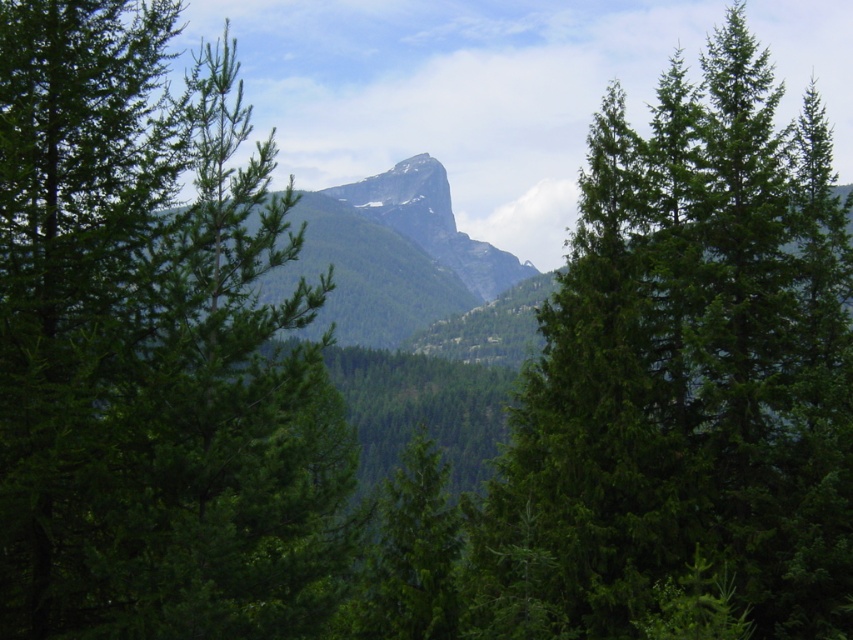
Is green matte tree at center shorter than green textured mountain at center?

Indeed, green matte tree at center has a lesser height compared to green textured mountain at center.

Is the position of green matte tree at center more distant than that of green textured mountain at center?

No, green matte tree at center is closer to the viewer.

Is point (531, 605) positioned before point (397, 339)?

Yes, point (531, 605) is in front of point (397, 339).

Find the location of a particular element. green matte tree at center is located at coordinates (685, 376).

Who is more distant from viewer, (267, 234) or (718, 451)?

The point (718, 451) is behind.

Consider the image. Between green needle-like tree at center and green matte tree at center, which one appears on the right side from the viewer's perspective?

Positioned to the right is green matte tree at center.

The width and height of the screenshot is (853, 640). I want to click on green needle-like tree at center, so click(151, 349).

Does point (256, 330) come closer to viewer compared to point (436, 246)?

That is True.

Is green needle-like tree at center further to the viewer compared to green textured mountain at center?

No, green needle-like tree at center is in front of green textured mountain at center.

What do you see at coordinates (151, 349) in the screenshot? This screenshot has width=853, height=640. I see `green needle-like tree at center` at bounding box center [151, 349].

Image resolution: width=853 pixels, height=640 pixels. Identify the location of green needle-like tree at center. (151, 349).